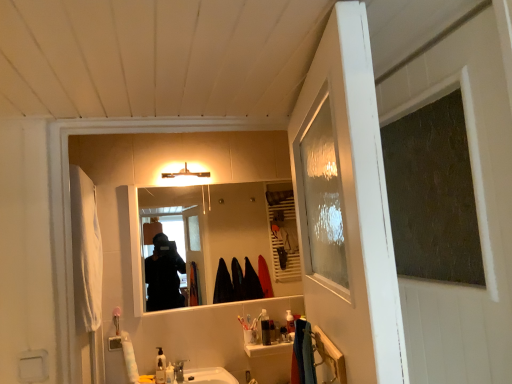
Question: Should I look upward or downward to see translucent plastic soap dispenser at center, placed as the fifth toiletry when sorted from front to back?

Choices:
 (A) up
 (B) down

Answer: (B)

Question: From a real-world perspective, is translucent plastic soap dispenser at center, which appears as the first toiletry when viewed from the right, located beneath translucent plastic soap dispenser at lower center, the 2th toiletry from the left?

Choices:
 (A) yes
 (B) no

Answer: (B)

Question: Is translucent plastic soap dispenser at center, placed as the fifth toiletry when sorted from front to back, not near translucent plastic soap dispenser at lower center, acting as the fifth toiletry starting from the back?

Choices:
 (A) no
 (B) yes

Answer: (A)

Question: Does translucent plastic soap dispenser at center, which appears as the first toiletry when viewed from the right, come in front of translucent plastic soap dispenser at lower center, acting as the fifth toiletry starting from the back?

Choices:
 (A) no
 (B) yes

Answer: (A)

Question: From the image's perspective, is translucent plastic soap dispenser at center, arranged as the 5th toiletry when viewed from the left, on translucent plastic soap dispenser at lower center, acting as the first toiletry starting from the front?

Choices:
 (A) no
 (B) yes

Answer: (B)

Question: Can translucent plastic soap dispenser at lower center, which is the 4th toiletry in right-to-left order, be found inside translucent plastic soap dispenser at center, the first toiletry from the back?

Choices:
 (A) no
 (B) yes

Answer: (A)

Question: Can we say translucent plastic soap dispenser at center, the first toiletry from the back, lies outside translucent plastic soap dispenser at lower center, acting as the fifth toiletry starting from the back?

Choices:
 (A) no
 (B) yes

Answer: (B)

Question: Would you consider smooth reflective mirror at center to be distant from translucent plastic soap dispenser at lower center, acting as the fifth toiletry starting from the back?

Choices:
 (A) yes
 (B) no

Answer: (A)

Question: Is smooth reflective mirror at center smaller than translucent plastic soap dispenser at lower center, acting as the fifth toiletry starting from the back?

Choices:
 (A) no
 (B) yes

Answer: (A)

Question: Does smooth reflective mirror at center have a lesser height compared to translucent plastic soap dispenser at lower center, the 2th toiletry from the left?

Choices:
 (A) yes
 (B) no

Answer: (B)

Question: From a real-world perspective, is smooth reflective mirror at center physically below translucent plastic soap dispenser at lower center, which is the 4th toiletry in right-to-left order?

Choices:
 (A) yes
 (B) no

Answer: (B)

Question: Does smooth reflective mirror at center come behind translucent plastic soap dispenser at lower center, acting as the first toiletry starting from the front?

Choices:
 (A) yes
 (B) no

Answer: (A)

Question: Can you confirm if smooth reflective mirror at center is thinner than translucent plastic soap dispenser at lower center, which is the 4th toiletry in right-to-left order?

Choices:
 (A) no
 (B) yes

Answer: (B)

Question: Is translucent plastic soap dispenser at lower center, acting as the 5th toiletry starting from the right, to the left of translucent plastic toothbrush holder at center, arranged as the fourth toiletry when viewed from the left, from the viewer's perspective?

Choices:
 (A) no
 (B) yes

Answer: (B)